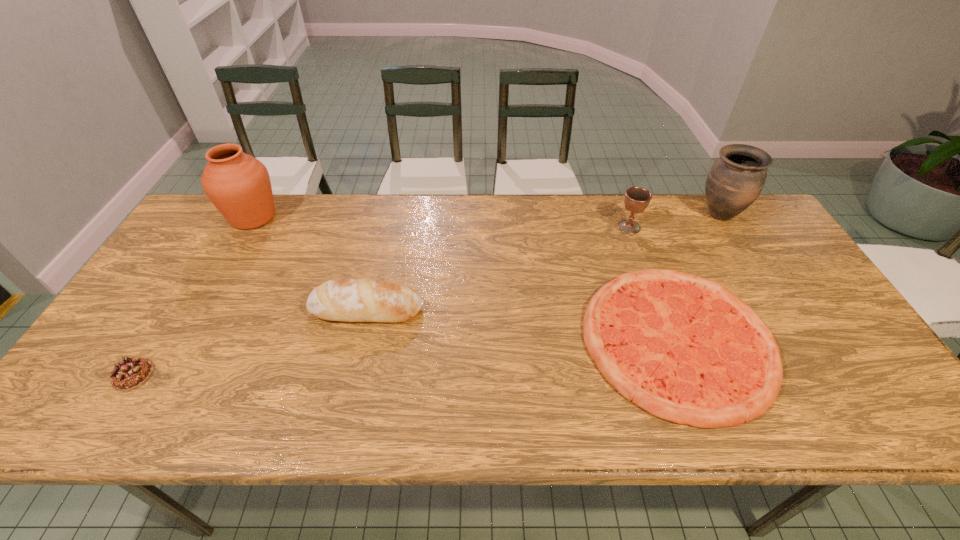
Locate an element on the screen. vacant space in between the left urn and the right urn is located at coordinates (486, 216).

At what (x,y) coordinates should I click in order to perform the action: click on free space between the left urn and the right urn. Please return your answer as a coordinate pair (x, y). Looking at the image, I should click on (486, 216).

Where is `free space between the left urn and the fifth tallest object`? The height and width of the screenshot is (540, 960). free space between the left urn and the fifth tallest object is located at coordinates (193, 296).

This screenshot has width=960, height=540. Identify the location of empty location between the bread and the chocolate cake. (251, 342).

Identify which object is the fifth nearest to the left urn. Please provide its 2D coordinates. Your answer should be formatted as a tuple, i.e. [(x, y)], where the tuple contains the x and y coordinates of a point satisfying the conditions above.

[(735, 180)]

You are a GUI agent. You are given a task and a screenshot of the screen. Output one action in this format:
    pyautogui.click(x=<x>, y=<y>)
    Task: Click on the object identified as the closest to the fourth object from right to left
    This screenshot has width=960, height=540.
    Given the screenshot: What is the action you would take?
    pyautogui.click(x=239, y=186)

I want to click on vacant region that satisfies the following two spatial constraints: 1. on the back side of the pizza; 2. on the right side of the right urn, so click(630, 215).